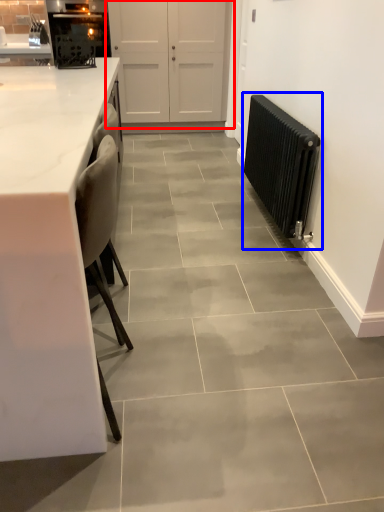
Question: Which of the following is the farthest to the observer, door (highlighted by a red box) or radiator (highlighted by a blue box)?

Choices:
 (A) door
 (B) radiator

Answer: (A)